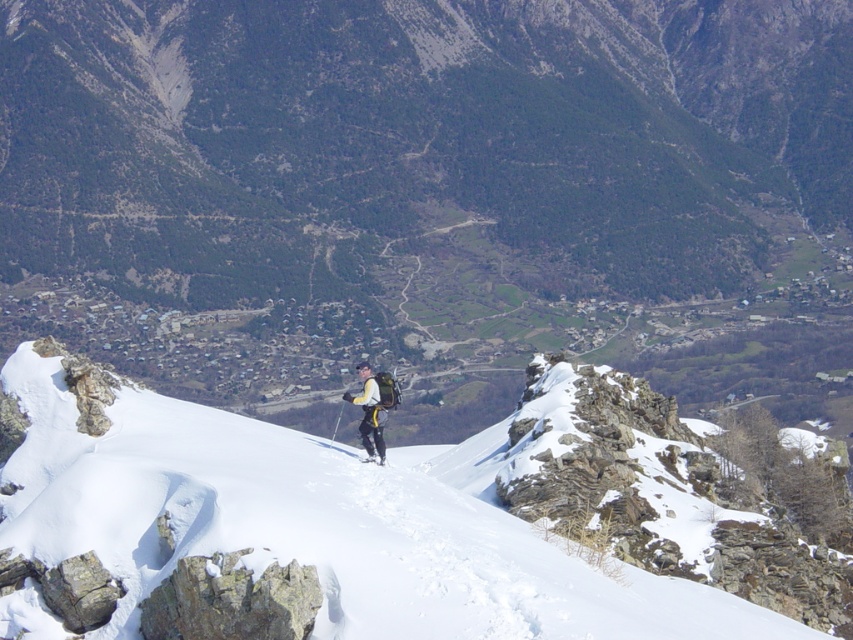
You are a photographer standing at the edge of the snowy ridge. You want to capture a photo that includes both the white powdery snow at center and the white fabric jacket at center. What is the minimum distance you need to move forward or backward to ensure both objects are in frame?

The white powdery snow at center and white fabric jacket at center are 15.43 meters apart. To ensure both are in frame, you need to position yourself so that the distance between them fits within your camera lens field of view. Since the exact field of view depends on your camera settings, but the separation is 15.43 meters, you must move to a point where this distance is within your camera lens range.

You are a hiker trying to navigate through the snowy ridge. You see the white powdery snow at center and the white fabric jacket at center. Which object is closer to you as you stand on the ridge?

The white powdery snow at center is closer to you because it is in front of the white fabric jacket at center.

Looking at this image, you are a hiker trying to navigate the snowy ridge. You see the white powdery snow at center and the white fabric jacket at center. Which object is closer to you?

The white powdery snow at center is located below the white fabric jacket at center, so the white fabric jacket at center is closer to you.